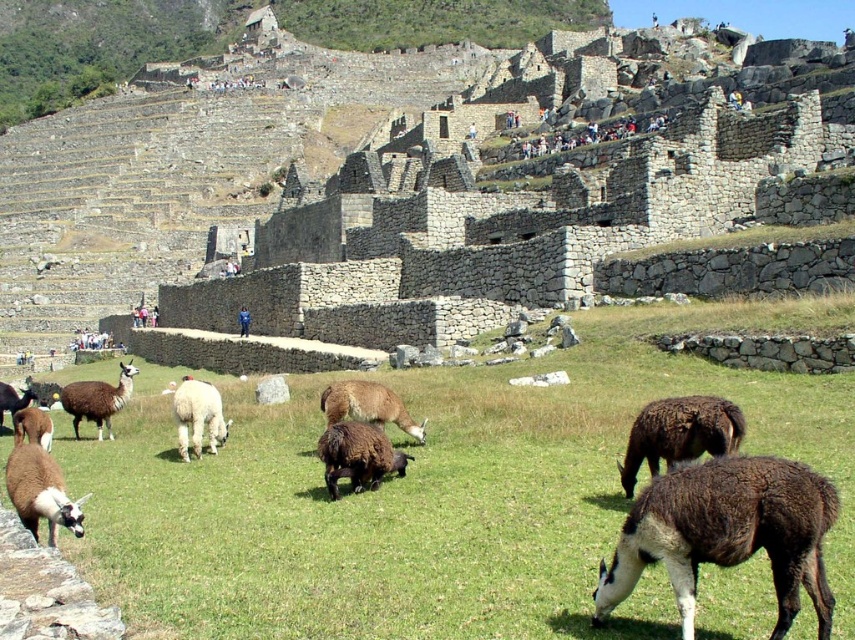
You are standing at the viewpoint overlooking Machu Picchu and want to take a photo. You notice two points marked in the scene. The first point is at coordinates point (x=375, y=445) and the second is at point (x=340, y=392). Which point is closer to you?

Point (x=375, y=445) is closer to the viewer than point (x=340, y=392).

You are a photographer standing at the entrance of Machu Picchu. You want to capture a photo of the brown woolen sheep at center and the green grassy field at center. Which object should you frame first in your camera viewfinder to ensure both are in the shot?

The green grassy field at center is positioned on the left side of brown woolen sheep at center, so you should frame the green grassy field at center first to ensure both are in the shot.

You are standing at the grassy area in front of Machu Picchu. You notice two points marked on the ground at coordinates point (258, 440) and point (384, 445). If you want to walk towards the ancient stone structures, which point should you start from to be closer to the structures?

You should start from point (384, 445) because it is in front of point (258, 440), meaning it is closer to the ancient stone structures of Machu Picchu.